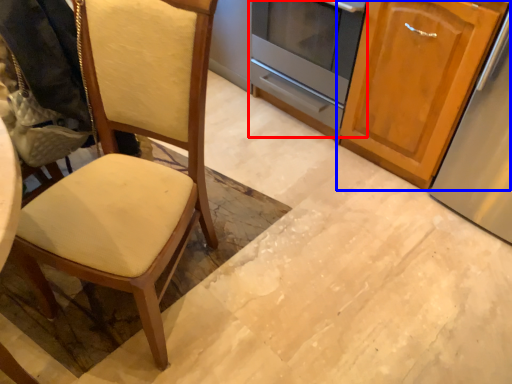
Question: Among these objects, which one is nearest to the camera, oven (highlighted by a red box) or cabinetry (highlighted by a blue box)?

Choices:
 (A) oven
 (B) cabinetry

Answer: (B)